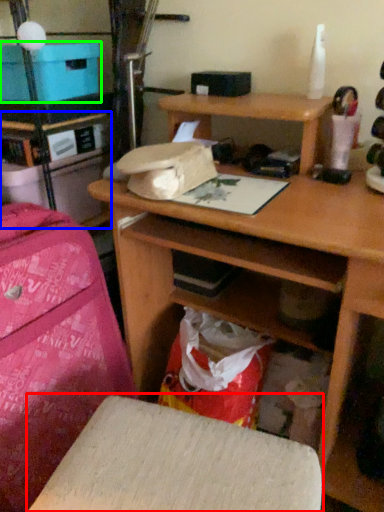
Question: Which object is positioned closest to furniture (highlighted by a red box)? Select from shelf (highlighted by a blue box) and cardboard box (highlighted by a green box).

Choices:
 (A) shelf
 (B) cardboard box

Answer: (A)